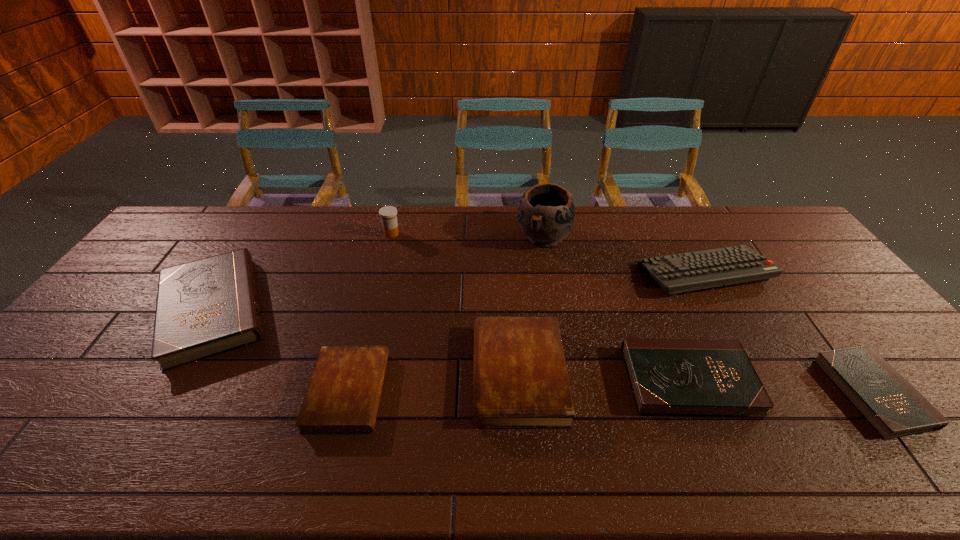
Image resolution: width=960 pixels, height=540 pixels. In order to click on the second green Bible from left to right in this screenshot , I will do (x=669, y=377).

Find the location of `the left reddish-brown Bible`. the left reddish-brown Bible is located at coordinates (343, 395).

Where is `the fourth Bible from right to left`? The height and width of the screenshot is (540, 960). the fourth Bible from right to left is located at coordinates (343, 395).

The height and width of the screenshot is (540, 960). What are the coordinates of `the rightmost green Bible` in the screenshot? It's located at (890, 404).

Image resolution: width=960 pixels, height=540 pixels. In order to click on the smallest green Bible in this screenshot , I will do `click(890, 404)`.

Where is `vacant space situated on the right of the tallest object`? The height and width of the screenshot is (540, 960). vacant space situated on the right of the tallest object is located at coordinates pyautogui.click(x=674, y=237).

This screenshot has height=540, width=960. Find the location of `vacant space located on the label of the medicine`. vacant space located on the label of the medicine is located at coordinates (466, 234).

At what (x,y) coordinates should I click in order to perform the action: click on blank space located on the back of the computer keyboard. Please return your answer as a coordinate pair (x, y). Image resolution: width=960 pixels, height=540 pixels. Looking at the image, I should click on (674, 219).

At what (x,y) coordinates should I click in order to perform the action: click on free point located 0.380m on the right of the leftmost green Bible. Please return your answer as a coordinate pair (x, y). Looking at the image, I should click on (409, 309).

Where is `free region located 0.130m on the spine side of the right reddish-brown Bible`? The width and height of the screenshot is (960, 540). free region located 0.130m on the spine side of the right reddish-brown Bible is located at coordinates (422, 374).